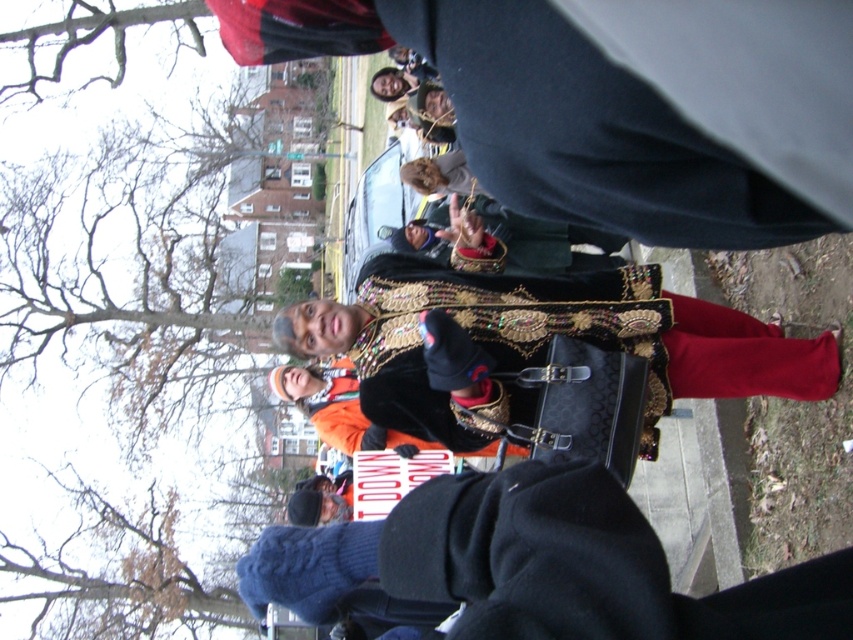
You are a fashion designer observing the image. You need to decide which item would be more suitable for a winter collection. Based on the thickness of the knitted wool sweater at lower center and the velvet black cape at center, which one would you choose?

The velvet black cape at center is thicker than the knitted wool sweater at lower center, so it would be more suitable for a winter collection.

You are standing at the position of the camera in the scene. You want to pick up the knitted wool sweater at lower center. Can you reach it without moving your feet?

The knitted wool sweater at lower center is 18.82 meters away from the camera, so you cannot reach it without moving your feet.